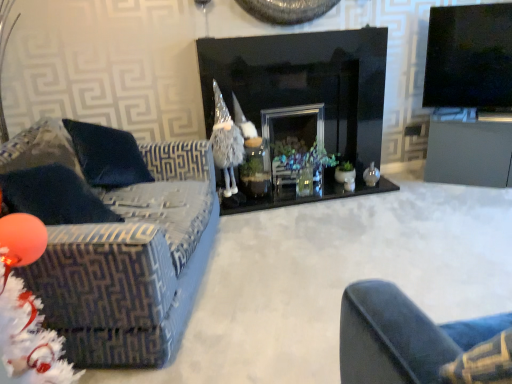
At what (x,y) coordinates should I click in order to perform the action: click on free space in front of translucent glass vase at center. Please return your answer as a coordinate pair (x, y). Looking at the image, I should click on (302, 218).